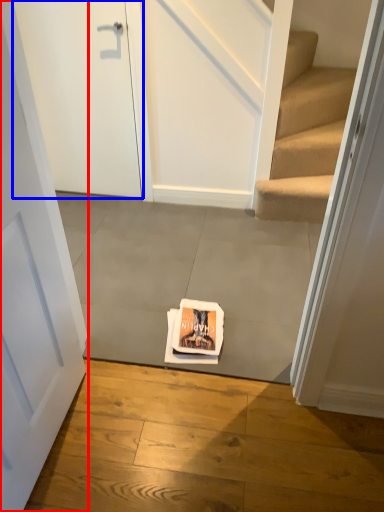
Question: Among these objects, which one is nearest to the camera, door (highlighted by a red box) or door (highlighted by a blue box)?

Choices:
 (A) door
 (B) door

Answer: (A)